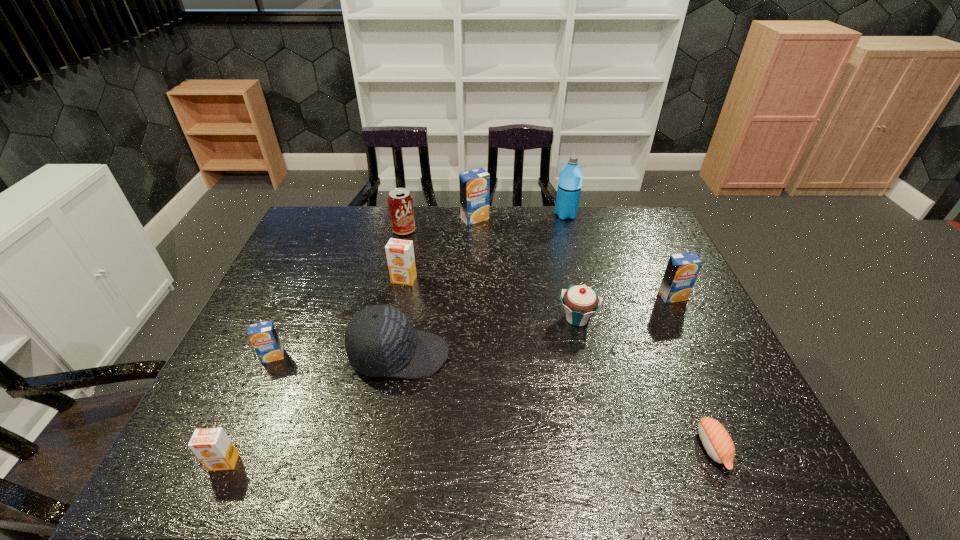
In order to click on the leftmost blue orange_juice in this screenshot , I will do coord(263,336).

Find the location of a particular element. The image size is (960, 540). the nearest blue orange_juice is located at coordinates (263, 336).

In order to click on the nearer orange orange juice in this screenshot , I will do `click(212, 446)`.

Where is `the left orange orange juice`? The width and height of the screenshot is (960, 540). the left orange orange juice is located at coordinates (212, 446).

Find the location of a particular element. sushi is located at coordinates (717, 442).

I want to click on salmon sushi, so click(717, 442).

You are a GUI agent. You are given a task and a screenshot of the screen. Output one action in this format:
    pyautogui.click(x=<x>, y=<y>)
    Task: Click on the vacant space located on the left of the thermos bottle
    
    Given the screenshot: What is the action you would take?
    pyautogui.click(x=519, y=214)

I want to click on free location located 0.290m on the front of the ninth shortest object, so click(x=474, y=279).

At what (x,y) coordinates should I click in order to perform the action: click on free location located on the right of the soda can. Please return your answer as a coordinate pair (x, y). The height and width of the screenshot is (540, 960). Looking at the image, I should click on (495, 230).

Identify the location of blank space located 0.320m on the left of the second farthest orange juice. This screenshot has width=960, height=540. (287, 280).